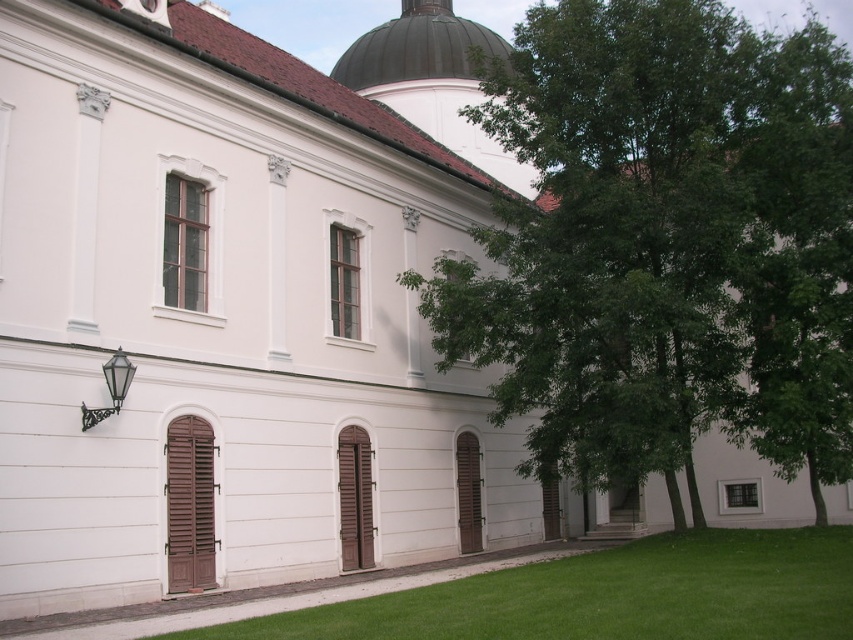
How distant is green leafy tree at center from green grass at lower center?

green leafy tree at center is 11.75 meters from green grass at lower center.

Between green leafy tree at center and green grass at lower center, which one has less height?

green grass at lower center is shorter.

Is point (582, 307) farther from camera compared to point (674, 630)?

Yes, it is behind point (674, 630).

At what (x,y) coordinates should I click in order to perform the action: click on green leafy tree at center. Please return your answer as a coordinate pair (x, y). The image size is (853, 640). Looking at the image, I should click on (665, 243).